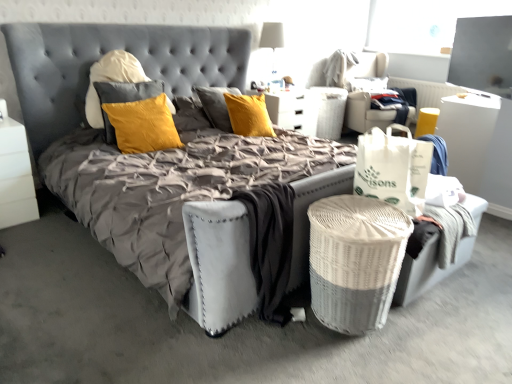
Question: Would you say transparent glass window screen at upper right is a long distance from white fabric lampshade at upper center?

Choices:
 (A) no
 (B) yes

Answer: (B)

Question: Does transparent glass window screen at upper right have a greater width compared to white fabric lampshade at upper center?

Choices:
 (A) yes
 (B) no

Answer: (B)

Question: Could you tell me if transparent glass window screen at upper right is turned towards white fabric lampshade at upper center?

Choices:
 (A) no
 (B) yes

Answer: (A)

Question: Is transparent glass window screen at upper right not within white fabric lampshade at upper center?

Choices:
 (A) no
 (B) yes

Answer: (B)

Question: Is transparent glass window screen at upper right in contact with white fabric lampshade at upper center?

Choices:
 (A) no
 (B) yes

Answer: (A)

Question: From the image's perspective, is transparent glass window screen at upper right on white fabric lampshade at upper center?

Choices:
 (A) no
 (B) yes

Answer: (A)

Question: Can you confirm if white wicker basket at center is positioned to the right of white wicker laundry basket at lower right?

Choices:
 (A) yes
 (B) no

Answer: (A)

Question: Is white wicker laundry basket at lower right completely or partially inside white wicker basket at center?

Choices:
 (A) yes
 (B) no

Answer: (B)

Question: From a real-world perspective, does white wicker basket at center sit lower than white wicker laundry basket at lower right?

Choices:
 (A) yes
 (B) no

Answer: (B)

Question: Is white wicker basket at center behind white wicker laundry basket at lower right?

Choices:
 (A) no
 (B) yes

Answer: (B)

Question: Considering the relative sizes of white wicker basket at center and white wicker laundry basket at lower right in the image provided, is white wicker basket at center smaller than white wicker laundry basket at lower right?

Choices:
 (A) no
 (B) yes

Answer: (A)

Question: Is white wicker laundry basket at lower right at the back of white wicker basket at center?

Choices:
 (A) no
 (B) yes

Answer: (A)

Question: Could you tell me if yellow fabric swivel chair at upper right, the first swivel chair when ordered from right to left, is facing white paper bag at right?

Choices:
 (A) yes
 (B) no

Answer: (B)